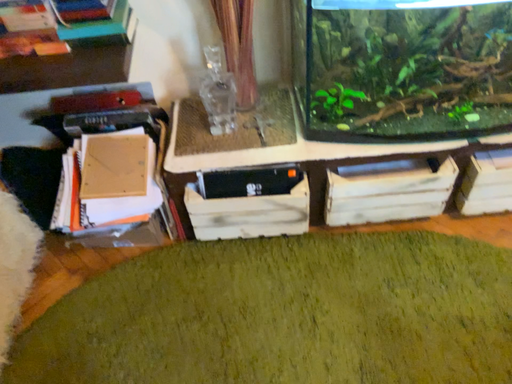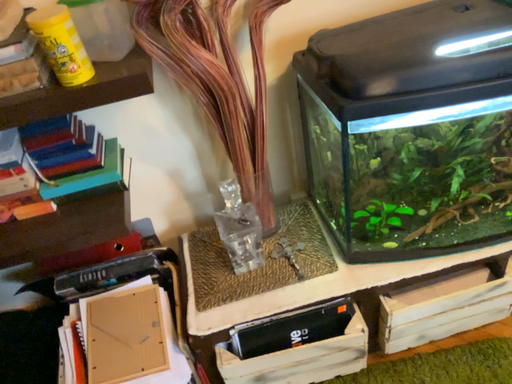
Question: How did the camera likely rotate when shooting the video?

Choices:
 (A) rotated downward
 (B) rotated upward

Answer: (B)